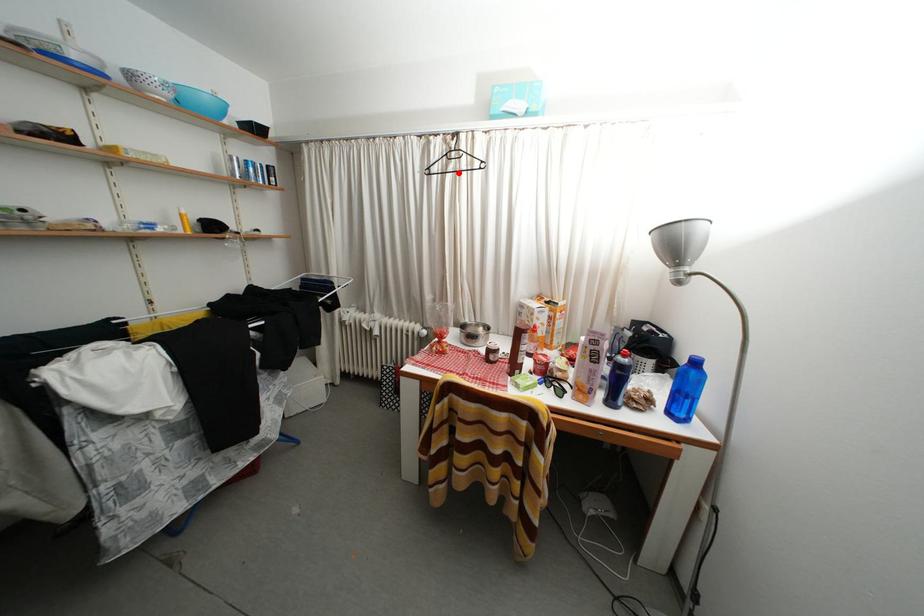
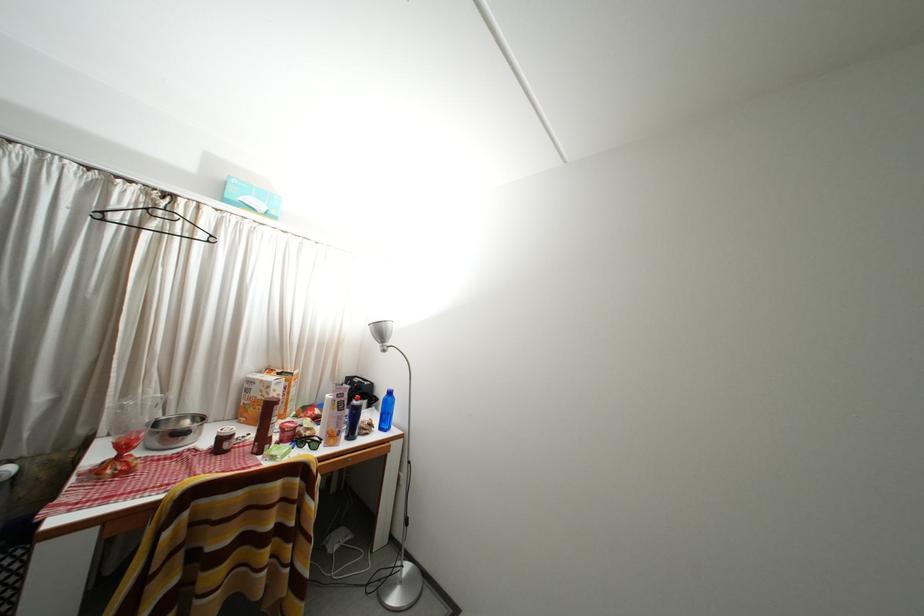
Locate, in the second image, the point that corresponds to the highlighted location in the first image.

(161, 230)